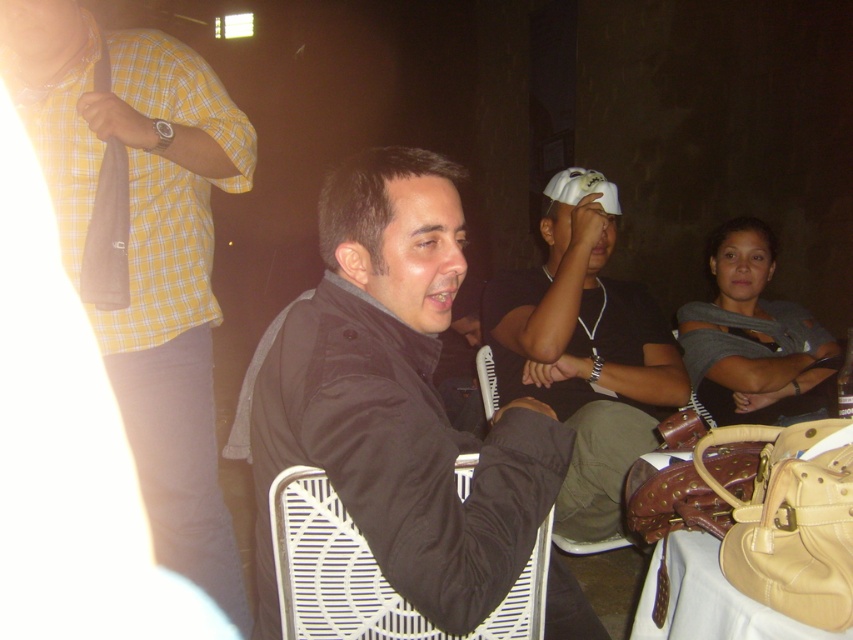
Does point (590, 314) lie behind point (730, 620)?

Yes, point (590, 314) is farther from viewer.

Does white matte cap at center have a smaller size compared to beige leather table at lower right?

Incorrect, white matte cap at center is not smaller in size than beige leather table at lower right.

Where is `white matte cap at center`? The width and height of the screenshot is (853, 640). white matte cap at center is located at coordinates (584, 349).

You are a GUI agent. You are given a task and a screenshot of the screen. Output one action in this format:
    pyautogui.click(x=<x>, y=<y>)
    Task: Click on the white matte cap at center
    The height and width of the screenshot is (640, 853).
    Given the screenshot: What is the action you would take?
    pyautogui.click(x=584, y=349)

Does white plastic chair at center appear on the right side of beige leather table at lower right?

Incorrect, white plastic chair at center is not on the right side of beige leather table at lower right.

Which is in front, point (502, 628) or point (747, 598)?

Point (747, 598) is more forward.

Locate an element on the screen. white plastic chair at center is located at coordinates (369, 573).

Between point (195, 100) and point (686, 584), which one is positioned in front?

Point (686, 584)

Between point (183, 138) and point (726, 614), which one is positioned in front?

Positioned in front is point (726, 614).

Locate an element on the screen. The width and height of the screenshot is (853, 640). yellow checkered shirt at upper left is located at coordinates (144, 250).